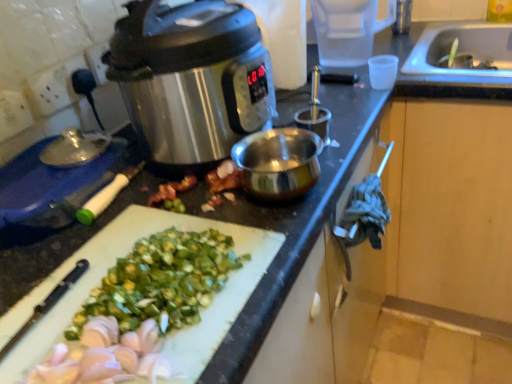
Describe the element at coordinates (191, 78) in the screenshot. This screenshot has width=512, height=384. I see `stainless steel slow cooker at upper left` at that location.

What do you see at coordinates (113, 264) in the screenshot? The width and height of the screenshot is (512, 384). I see `white plastic cutting board at lower left` at bounding box center [113, 264].

The image size is (512, 384). I want to click on stainless steel slow cooker at upper left, so click(191, 78).

Is transparent plastic cup at upper right positioned far away from stainless steel slow cooker at upper left?

transparent plastic cup at upper right is actually quite close to stainless steel slow cooker at upper left.

Is transparent plastic cup at upper right to the right of stainless steel slow cooker at upper left from the viewer's perspective?

Correct, you'll find transparent plastic cup at upper right to the right of stainless steel slow cooker at upper left.

From the image's perspective, is transparent plastic cup at upper right above or below stainless steel slow cooker at upper left?

From the image's perspective, transparent plastic cup at upper right appears above stainless steel slow cooker at upper left.

Is stainless steel slow cooker at upper left at the back of transparent plastic cup at upper right?

No, transparent plastic cup at upper right is not facing the opposite direction of stainless steel slow cooker at upper left.

Measure the distance between white plastic cutting board at lower left and stainless steel slow cooker at upper left.

white plastic cutting board at lower left and stainless steel slow cooker at upper left are 9.46 inches apart.

Would you say white plastic cutting board at lower left is inside or outside stainless steel slow cooker at upper left?

white plastic cutting board at lower left is not inside stainless steel slow cooker at upper left, it's outside.

Can you confirm if white plastic cutting board at lower left is bigger than stainless steel slow cooker at upper left?

Incorrect, white plastic cutting board at lower left is not larger than stainless steel slow cooker at upper left.

Is white plastic cutting board at lower left positioned with its back to stainless steel slow cooker at upper left?

No, stainless steel slow cooker at upper left is not at the back of white plastic cutting board at lower left.

Which is correct: white plastic cutting board at lower left is inside transparent plastic cup at upper right, or outside of it?

white plastic cutting board at lower left is not enclosed by transparent plastic cup at upper right.

Considering the relative sizes of white plastic cutting board at lower left and transparent plastic cup at upper right in the image provided, is white plastic cutting board at lower left wider than transparent plastic cup at upper right?

Indeed, white plastic cutting board at lower left has a greater width compared to transparent plastic cup at upper right.

Which point is more forward, (190,217) or (325,50)?

The point (190,217) is closer to the camera.

From a real-world perspective, between white plastic cutting board at lower left and transparent plastic cup at upper right, who is vertically higher?

In real-world perspective, transparent plastic cup at upper right is above.

Could transparent plastic cup at upper right be considered to be inside stainless steel slow cooker at upper left?

No, stainless steel slow cooker at upper left does not contain transparent plastic cup at upper right.

Is stainless steel slow cooker at upper left next to transparent plastic cup at upper right and touching it?

No, stainless steel slow cooker at upper left is not touching transparent plastic cup at upper right.

Which is nearer, (253, 81) or (330, 15)?

Point (253, 81)

Would you say stainless steel slow cooker at upper left is inside or outside white plastic cutting board at lower left?

stainless steel slow cooker at upper left is not enclosed by white plastic cutting board at lower left.

Is white plastic cutting board at lower left at the back of stainless steel slow cooker at upper left?

No.

Is stainless steel slow cooker at upper left beside white plastic cutting board at lower left?

There is a gap between stainless steel slow cooker at upper left and white plastic cutting board at lower left.

From a real-world perspective, between stainless steel slow cooker at upper left and white plastic cutting board at lower left, who is vertically higher?

From a 3D spatial view, stainless steel slow cooker at upper left is above.

Is transparent plastic cup at upper right in front of white plastic cutting board at lower left?

No, it is not.

Measure the distance between transparent plastic cup at upper right and white plastic cutting board at lower left.

A distance of 31.68 inches exists between transparent plastic cup at upper right and white plastic cutting board at lower left.

Is there a large distance between transparent plastic cup at upper right and white plastic cutting board at lower left?

That's not correct — transparent plastic cup at upper right is a little close to white plastic cutting board at lower left.

Considering the sizes of transparent plastic cup at upper right and white plastic cutting board at lower left in the image, is transparent plastic cup at upper right taller or shorter than white plastic cutting board at lower left?

transparent plastic cup at upper right is taller than white plastic cutting board at lower left.

You are a GUI agent. You are given a task and a screenshot of the screen. Output one action in this format:
    pyautogui.click(x=<x>, y=<y>)
    Task: Click on the slow cooker above the transparent plastic cup at upper right (from a real-world perspective)
    This screenshot has height=384, width=512.
    Given the screenshot: What is the action you would take?
    click(x=191, y=78)

I want to click on slow cooker that is on the right side of white plastic cutting board at lower left, so click(191, 78).

Based on their spatial positions, is stainless steel slow cooker at upper left or transparent plastic cup at upper right closer to white plastic cutting board at lower left?

Based on the image, stainless steel slow cooker at upper left appears to be nearer to white plastic cutting board at lower left.

From the image, which object appears to be farther from white plastic cutting board at lower left, transparent plastic cup at upper right or stainless steel slow cooker at upper left?

transparent plastic cup at upper right is positioned further to the anchor white plastic cutting board at lower left.

Looking at the image, which one is located closer to stainless steel slow cooker at upper left, transparent plastic cup at upper right or white plastic cutting board at lower left?

The object closer to stainless steel slow cooker at upper left is white plastic cutting board at lower left.

When comparing their distances from transparent plastic cup at upper right, does stainless steel slow cooker at upper left or white plastic cutting board at lower left seem further?

Among the two, white plastic cutting board at lower left is located further to transparent plastic cup at upper right.

Based on their spatial positions, is white plastic cutting board at lower left or transparent plastic cup at upper right closer to stainless steel slow cooker at upper left?

Based on the image, white plastic cutting board at lower left appears to be nearer to stainless steel slow cooker at upper left.

Considering their positions, is white plastic cutting board at lower left positioned further to transparent plastic cup at upper right than stainless steel slow cooker at upper left?

Among the two, white plastic cutting board at lower left is located further to transparent plastic cup at upper right.

The height and width of the screenshot is (384, 512). Find the location of `slow cooker positioned between white plastic cutting board at lower left and transparent plastic cup at upper right from near to far`. slow cooker positioned between white plastic cutting board at lower left and transparent plastic cup at upper right from near to far is located at coordinates (191, 78).